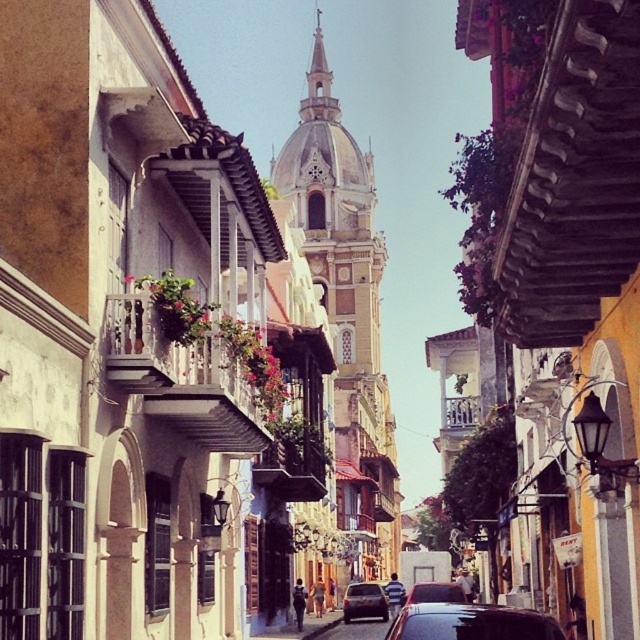
Question: Based on their relative distances, which object is farther from the matte black car at center?

Choices:
 (A) golden stone church at center
 (B) shiny black car at center
 (C) shiny black sedan at center
 (D) metallic silver car at center

Answer: (A)

Question: Is golden stone church at center bigger than matte black car at center?

Choices:
 (A) no
 (B) yes

Answer: (B)

Question: Among these objects, which one is farthest from the camera?

Choices:
 (A) golden stone church at center
 (B) shiny black sedan at center
 (C) matte black car at center
 (D) shiny black car at center

Answer: (A)

Question: Can you confirm if shiny black car at center is wider than shiny black sedan at center?

Choices:
 (A) yes
 (B) no

Answer: (B)

Question: Among these objects, which one is nearest to the camera?

Choices:
 (A) metallic silver car at center
 (B) golden stone church at center

Answer: (B)

Question: Is shiny black car at center below shiny black sedan at center?

Choices:
 (A) no
 (B) yes

Answer: (A)